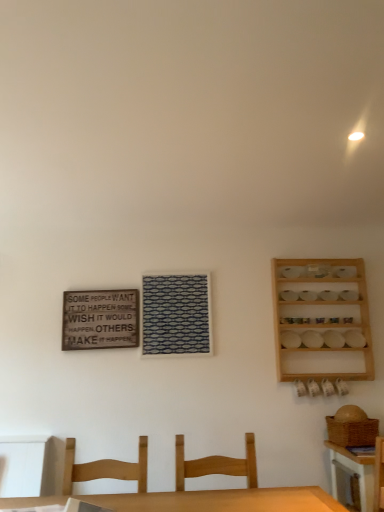
Question: Looking at the image, does wooden signboard at upper left seem bigger or smaller compared to wooden chair at center, positioned as the second chair in left-to-right order?

Choices:
 (A) small
 (B) big

Answer: (A)

Question: Considering their positions, is wooden signboard at upper left located in front of or behind wooden chair at center, positioned as the second chair in left-to-right order?

Choices:
 (A) behind
 (B) front

Answer: (A)

Question: Which of these objects is positioned closest to the light brown wood chair at lower center, placed as the second chair when sorted from right to left?

Choices:
 (A) wooden signboard at upper left
 (B) wooden chair at center, the 1th chair when ordered from right to left
 (C) wooden spice rack at right
 (D) wooden table at lower right

Answer: (B)

Question: Which is nearer to the wooden table at lower right?

Choices:
 (A) light brown wood chair at lower center, placed as the second chair when sorted from right to left
 (B) wooden spice rack at right
 (C) wooden chair at center, the 1th chair when ordered from right to left
 (D) wooden signboard at upper left

Answer: (C)